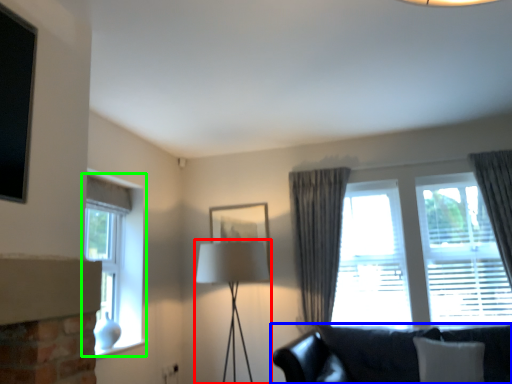
Question: Estimate the real-world distances between objects in this image. Which object is farther from table lamp (highlighted by a red box), studio couch (highlighted by a blue box) or window (highlighted by a green box)?

Choices:
 (A) studio couch
 (B) window

Answer: (A)